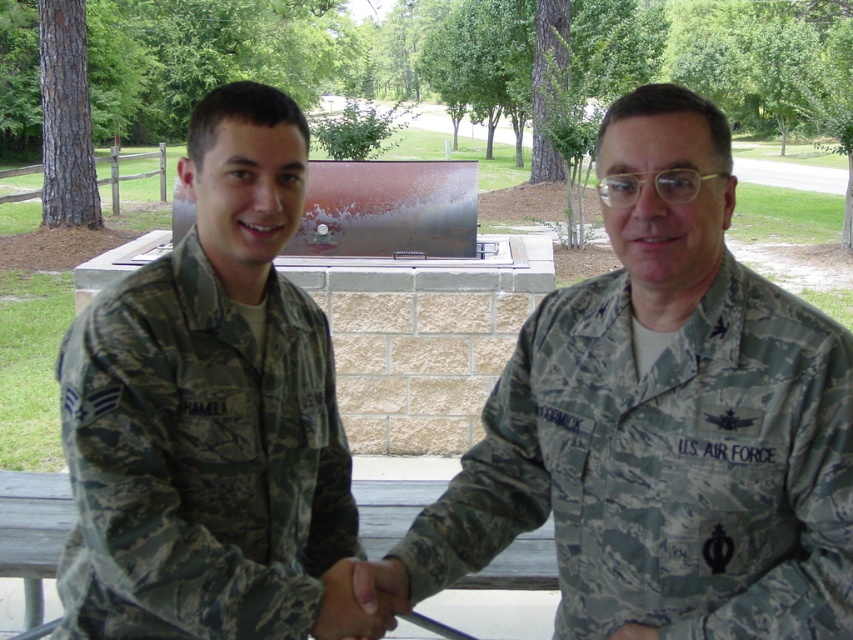
You are an observer standing in front of the brick structure with a metallic grill. You see two camouflage uniforms, the camouflage uniform at center and the camouflage uniform at left. Which one is closer to you?

Result: The camouflage uniform at center is closer to you because it is in front of the camouflage uniform at left.

You are a photographer at a U.S. Air Force event. You need to arrange two camouflage uniforms for a group photo. The scene shows a camouflage uniform at center and a camouflage uniform at left. Which camouflage uniform is positioned to the right of the other?

The camouflage uniform at center is positioned to the right of the camouflage uniform at left.